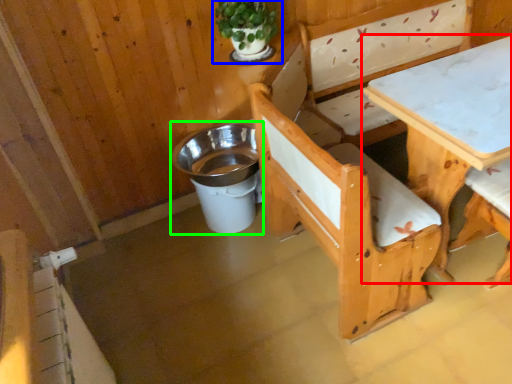
Question: Which is nearer to the table (highlighted by a red box)? houseplant (highlighted by a blue box) or trash bin/can (highlighted by a green box).

Choices:
 (A) houseplant
 (B) trash bin/can

Answer: (A)